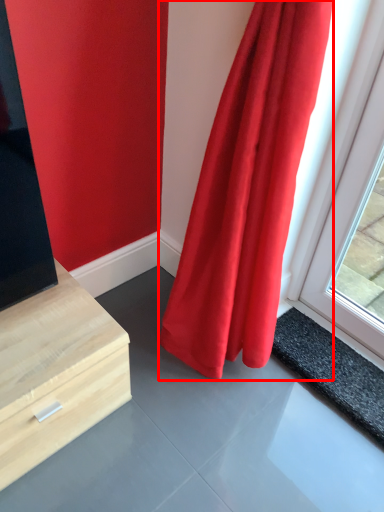
Question: Considering the relative positions of curtain (annotated by the red box) and slate in the image provided, where is curtain (annotated by the red box) located with respect to the staircase?

Choices:
 (A) right
 (B) left

Answer: (B)